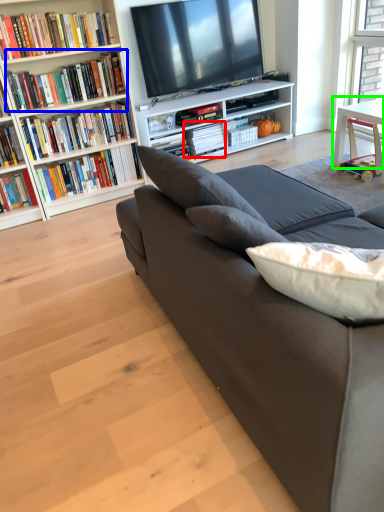
Question: Which object is positioned closest to book (highlighted by a red box)? Select from book (highlighted by a blue box) and table (highlighted by a green box).

Choices:
 (A) book
 (B) table

Answer: (A)